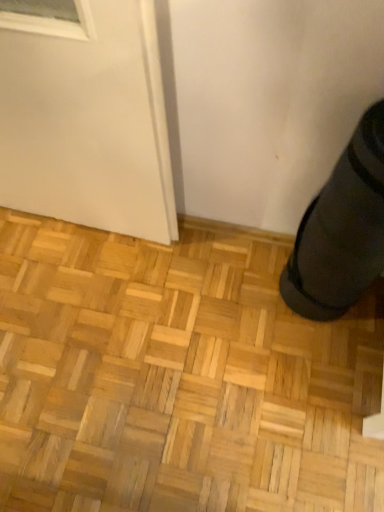
Question: Considering the relative sizes of black rubber shoe at lower right and natural wood parquet floor at lower right in the image provided, is black rubber shoe at lower right wider than natural wood parquet floor at lower right?

Choices:
 (A) no
 (B) yes

Answer: (A)

Question: Is black rubber shoe at lower right far from natural wood parquet floor at lower right?

Choices:
 (A) yes
 (B) no

Answer: (B)

Question: Is black rubber shoe at lower right thinner than natural wood parquet floor at lower right?

Choices:
 (A) yes
 (B) no

Answer: (A)

Question: Is black rubber shoe at lower right positioned before natural wood parquet floor at lower right?

Choices:
 (A) no
 (B) yes

Answer: (B)

Question: Is black rubber shoe at lower right at the left side of natural wood parquet floor at lower right?

Choices:
 (A) no
 (B) yes

Answer: (A)

Question: Does black rubber shoe at lower right have a smaller size compared to natural wood parquet floor at lower right?

Choices:
 (A) no
 (B) yes

Answer: (B)

Question: Is natural wood parquet floor at lower right to the right of black rubber shoe at lower right from the viewer's perspective?

Choices:
 (A) yes
 (B) no

Answer: (B)

Question: From the image's perspective, does natural wood parquet floor at lower right appear lower than black rubber shoe at lower right?

Choices:
 (A) yes
 (B) no

Answer: (A)

Question: Does natural wood parquet floor at lower right touch black rubber shoe at lower right?

Choices:
 (A) yes
 (B) no

Answer: (B)

Question: From the image's perspective, is natural wood parquet floor at lower right over black rubber shoe at lower right?

Choices:
 (A) no
 (B) yes

Answer: (A)

Question: From a real-world perspective, is natural wood parquet floor at lower right under black rubber shoe at lower right?

Choices:
 (A) no
 (B) yes

Answer: (B)

Question: Is there a large distance between natural wood parquet floor at lower right and black rubber shoe at lower right?

Choices:
 (A) yes
 (B) no

Answer: (B)

Question: Relative to natural wood parquet floor at lower right, is black rubber shoe at lower right in front or behind?

Choices:
 (A) front
 (B) behind

Answer: (A)